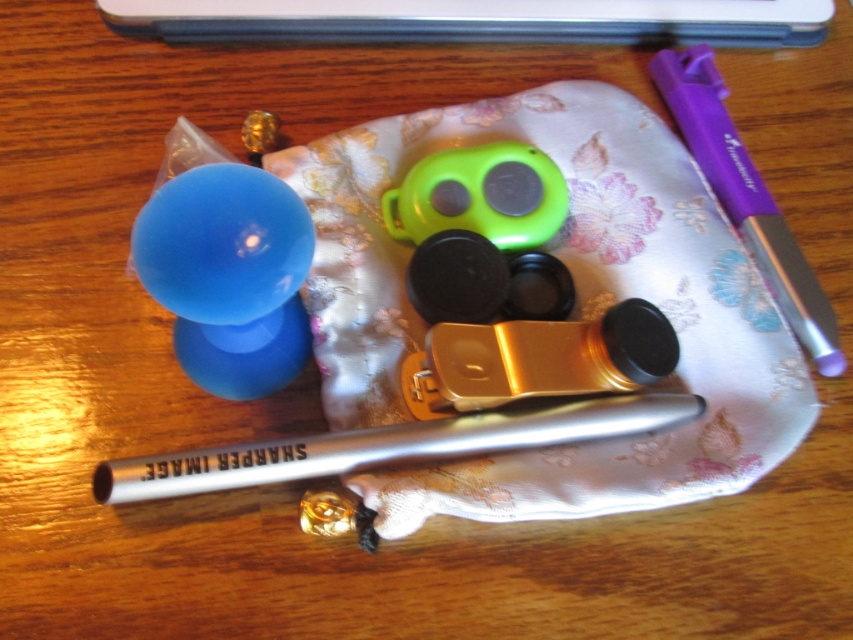
Who is positioned more to the left, glossy plastic balloon at upper left or matte blue balloon at center-left?

matte blue balloon at center-left

Which is in front, point (154, 272) or point (305, 337)?

Point (154, 272) is in front.

Which is behind, point (219, 280) or point (219, 352)?

The point (219, 352) is more distant.

Where is `glossy plastic balloon at upper left`? This screenshot has width=853, height=640. glossy plastic balloon at upper left is located at coordinates (222, 243).

Between gold metallic clip at center and green matte remote control at center, which one has less height?

Standing shorter between the two is gold metallic clip at center.

Can you confirm if gold metallic clip at center is positioned to the right of green matte remote control at center?

Correct, you'll find gold metallic clip at center to the right of green matte remote control at center.

The height and width of the screenshot is (640, 853). Describe the element at coordinates (538, 358) in the screenshot. I see `gold metallic clip at center` at that location.

Locate an element on the screen. The width and height of the screenshot is (853, 640). gold metallic clip at center is located at coordinates (538, 358).

Is silver metallic fountain pen at center to the left of glossy plastic balloon at upper left from the viewer's perspective?

No, silver metallic fountain pen at center is not to the left of glossy plastic balloon at upper left.

Is silver metallic fountain pen at center below glossy plastic balloon at upper left?

Yes, silver metallic fountain pen at center is below glossy plastic balloon at upper left.

Find the location of a particular element. Image resolution: width=853 pixels, height=640 pixels. silver metallic fountain pen at center is located at coordinates point(393,444).

You are a GUI agent. You are given a task and a screenshot of the screen. Output one action in this format:
    pyautogui.click(x=<x>, y=<y>)
    Task: Click on the silver metallic fountain pen at center
    The height and width of the screenshot is (640, 853).
    Given the screenshot: What is the action you would take?
    (393, 444)